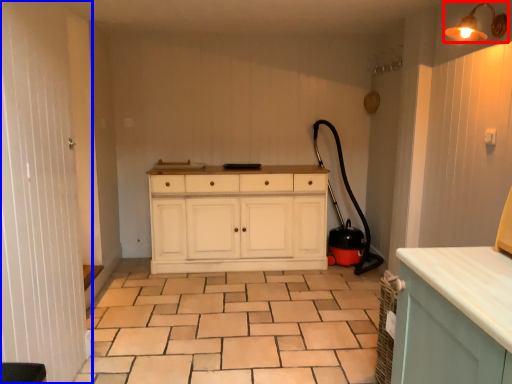
Question: Which object appears farthest to the camera in this image, light fixture (highlighted by a red box) or screen door (highlighted by a blue box)?

Choices:
 (A) light fixture
 (B) screen door

Answer: (A)